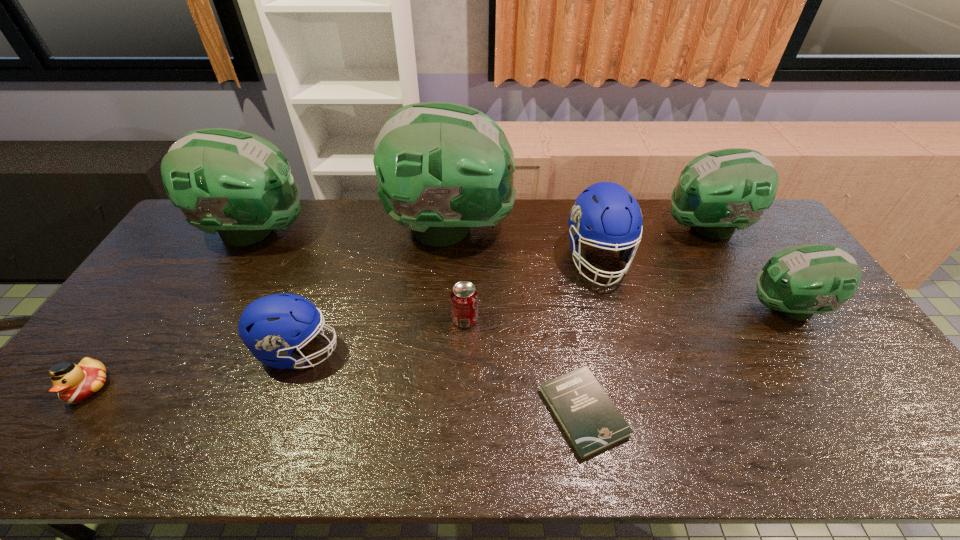
You are a GUI agent. You are given a task and a screenshot of the screen. Output one action in this format:
    pyautogui.click(x=<x>, y=<y>)
    Task: Click on the football helmet identified as the fifth closest to the second shortest object
    This screenshot has width=960, height=540.
    Given the screenshot: What is the action you would take?
    pyautogui.click(x=719, y=191)

Locate which football helmet is the closest to the soda can. Please provide its 2D coordinates. Your answer should be formatted as a tuple, i.e. [(x, y)], where the tuple contains the x and y coordinates of a point satisfying the conditions above.

[(443, 168)]

The image size is (960, 540). In order to click on green football helmet that is the third nearest to the soda can in this screenshot , I will do `click(719, 191)`.

I want to click on green football helmet that can be found as the closest to the fifth shortest football helmet, so click(443, 168).

This screenshot has height=540, width=960. Identify the location of vacant space that satisfies the following two spatial constraints: 1. on the visor of the soda can; 2. on the left side of the fourth football helmet from right to left. (444, 319).

This screenshot has width=960, height=540. Find the location of `free point that satisfies the following two spatial constraints: 1. on the visor of the second smallest green football helmet; 2. on the front-facing side of the bigger blue football helmet`. free point that satisfies the following two spatial constraints: 1. on the visor of the second smallest green football helmet; 2. on the front-facing side of the bigger blue football helmet is located at coordinates pyautogui.click(x=724, y=259).

What are the coordinates of `vacant region that satisfies the following two spatial constraints: 1. on the visor of the tallest football helmet; 2. on the right side of the soda can` in the screenshot? It's located at (444, 319).

The height and width of the screenshot is (540, 960). I want to click on free space that satisfies the following two spatial constraints: 1. on the visor of the fifth shortest football helmet; 2. on the left side of the book, so click(x=154, y=412).

Find the location of a particular element. The image size is (960, 540). free space that satisfies the following two spatial constraints: 1. on the visor of the tallest football helmet; 2. on the back side of the soda can is located at coordinates (444, 319).

In order to click on vacant region that satisfies the following two spatial constraints: 1. on the front-facing side of the dark book; 2. on the right side of the left blue football helmet in this screenshot , I will do `click(277, 412)`.